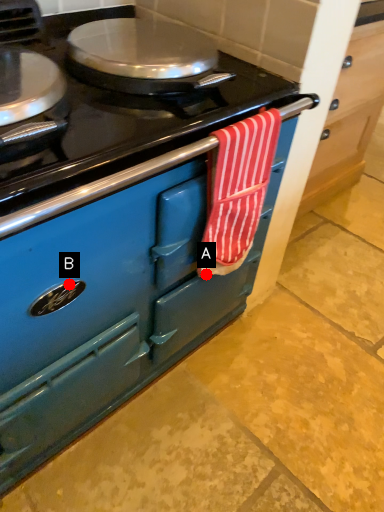
Question: Two points are circled on the image, labeled by A and B beside each circle. Which point is closer to the camera?

Choices:
 (A) A is closer
 (B) B is closer

Answer: (B)